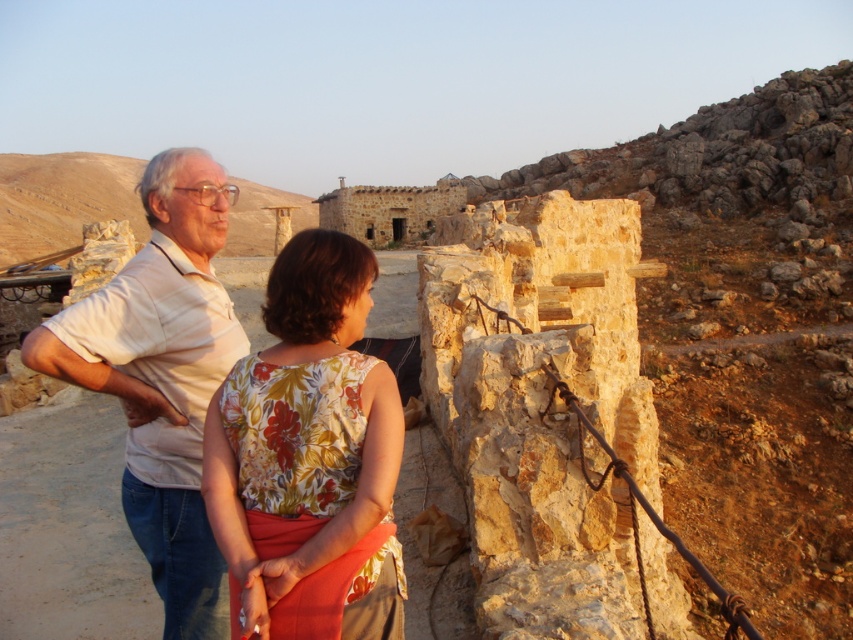
Question: Is floral fabric blouse at center bigger than light beige cotton shirt at left?

Choices:
 (A) no
 (B) yes

Answer: (A)

Question: Does floral fabric blouse at center have a greater width compared to light beige cotton shirt at left?

Choices:
 (A) no
 (B) yes

Answer: (A)

Question: Which of the following is the closest to the observer?

Choices:
 (A) light beige cotton shirt at left
 (B) floral fabric blouse at center

Answer: (B)

Question: Observing the image, what is the correct spatial positioning of floral fabric blouse at center in reference to light beige cotton shirt at left?

Choices:
 (A) below
 (B) above

Answer: (A)